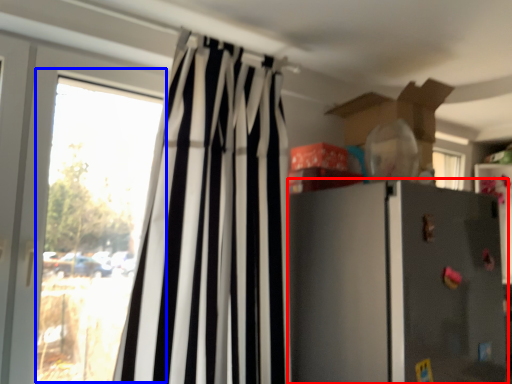
Question: Which object appears closest to the camera in this image, refrigerator (highlighted by a red box) or window (highlighted by a blue box)?

Choices:
 (A) refrigerator
 (B) window

Answer: (A)